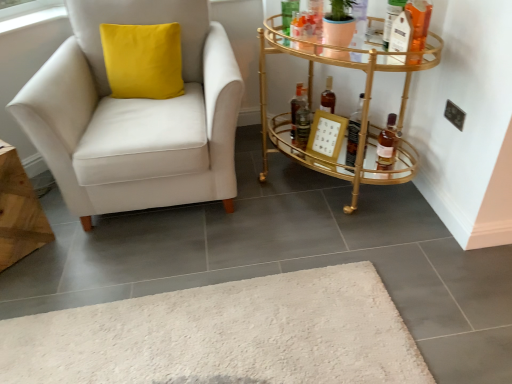
The width and height of the screenshot is (512, 384). Find the location of `gold metallic bar cart at right`. gold metallic bar cart at right is located at coordinates (360, 111).

I want to click on shiny dark brown bottle at center, the 1th bottle positioned from the left, so click(x=297, y=108).

In order to click on translucent glass bottle at right, the second bottle when ordered from right to left in this screenshot , I will do `click(354, 132)`.

Considering the positions of objects translucent glass bottle at right, which appears as the 1th bottle when viewed from the right, and shiny dark brown bottle at center, the 1th bottle positioned from the left, in the image provided, who is more to the left, translucent glass bottle at right, which appears as the 1th bottle when viewed from the right, or shiny dark brown bottle at center, the 1th bottle positioned from the left,?

Positioned to the left is shiny dark brown bottle at center, the 1th bottle positioned from the left.

Is translucent glass bottle at right, which ranks as the third bottle in left-to-right order, next to shiny dark brown bottle at center, acting as the 3th bottle starting from the right?

No, translucent glass bottle at right, which ranks as the third bottle in left-to-right order, is not with shiny dark brown bottle at center, acting as the 3th bottle starting from the right.

How distant is translucent glass bottle at right, which appears as the 1th bottle when viewed from the right, from shiny dark brown bottle at center, the 1th bottle positioned from the left?

A distance of 18.23 inches exists between translucent glass bottle at right, which appears as the 1th bottle when viewed from the right, and shiny dark brown bottle at center, the 1th bottle positioned from the left.

Is translucent glass bottle at right, which ranks as the third bottle in left-to-right order, shorter than shiny dark brown bottle at center, acting as the 3th bottle starting from the right?

Yes.

Considering the sizes of objects shiny dark brown bottle at center, acting as the 3th bottle starting from the right, and translucent glass bottle at right, which ranks as the third bottle in left-to-right order, in the image provided, who is shorter, shiny dark brown bottle at center, acting as the 3th bottle starting from the right, or translucent glass bottle at right, which ranks as the third bottle in left-to-right order,?

translucent glass bottle at right, which ranks as the third bottle in left-to-right order.

There is a translucent glass bottle at right, which ranks as the third bottle in left-to-right order. Where is `the 2nd bottle above it (from the image's perspective)`? The image size is (512, 384). the 2nd bottle above it (from the image's perspective) is located at coordinates (297, 108).

Can you tell me how much shiny dark brown bottle at center, the 1th bottle positioned from the left, and translucent glass bottle at right, which ranks as the third bottle in left-to-right order, differ in facing direction?

The angular difference between shiny dark brown bottle at center, the 1th bottle positioned from the left, and translucent glass bottle at right, which ranks as the third bottle in left-to-right order, is 37.9 degrees.

From a real-world perspective, is shiny dark brown bottle at center, acting as the 3th bottle starting from the right, physically below translucent glass bottle at right, which ranks as the third bottle in left-to-right order?

No, from a real-world perspective, shiny dark brown bottle at center, acting as the 3th bottle starting from the right, is not under translucent glass bottle at right, which ranks as the third bottle in left-to-right order.

Is shiny dark brown bottle at center, acting as the 3th bottle starting from the right, wider than translucent glass bottle at right, the 2th bottle viewed from the left?

In fact, shiny dark brown bottle at center, acting as the 3th bottle starting from the right, might be narrower than translucent glass bottle at right, the 2th bottle viewed from the left.

Is shiny dark brown bottle at center, acting as the 3th bottle starting from the right, turned away from translucent glass bottle at right, the second bottle when ordered from right to left?

shiny dark brown bottle at center, acting as the 3th bottle starting from the right, is not turned away from translucent glass bottle at right, the second bottle when ordered from right to left.

Considering the sizes of objects shiny dark brown bottle at center, the 1th bottle positioned from the left, and translucent glass bottle at right, the 2th bottle viewed from the left, in the image provided, who is smaller, shiny dark brown bottle at center, the 1th bottle positioned from the left, or translucent glass bottle at right, the 2th bottle viewed from the left,?

Smaller between the two is shiny dark brown bottle at center, the 1th bottle positioned from the left.

Is point (295, 96) in front of point (347, 153)?

No, it is behind (347, 153).

Considering the sizes of objects translucent glass bottle at right, the 2th bottle viewed from the left, and shiny dark brown bottle at center, the 1th bottle positioned from the left, in the image provided, who is thinner, translucent glass bottle at right, the 2th bottle viewed from the left, or shiny dark brown bottle at center, the 1th bottle positioned from the left,?

shiny dark brown bottle at center, the 1th bottle positioned from the left.

Is translucent glass bottle at right, the 2th bottle viewed from the left, not near shiny dark brown bottle at center, the 1th bottle positioned from the left?

No.

From a real-world perspective, count 1st bottles downward from the shiny dark brown bottle at center, the 1th bottle positioned from the left, and point to it. Please provide its 2D coordinates.

[(354, 132)]

From the image's perspective, is translucent glass bottle at right, the 2th bottle viewed from the left, under shiny dark brown bottle at center, the 1th bottle positioned from the left?

Correct, translucent glass bottle at right, the 2th bottle viewed from the left, appears lower than shiny dark brown bottle at center, the 1th bottle positioned from the left, in the image.

From the picture: Is translucent glass bottle at right, the second bottle when ordered from right to left, bigger or smaller than white fabric chair at left?

Clearly, translucent glass bottle at right, the second bottle when ordered from right to left, is smaller in size than white fabric chair at left.

From the image's perspective, is translucent glass bottle at right, the second bottle when ordered from right to left, beneath white fabric chair at left?

Yes, from the image's perspective, translucent glass bottle at right, the second bottle when ordered from right to left, is beneath white fabric chair at left.

Looking at this image, do you think translucent glass bottle at right, the 2th bottle viewed from the left, is within white fabric chair at left, or outside of it?

translucent glass bottle at right, the 2th bottle viewed from the left, cannot be found inside white fabric chair at left.

From a real-world perspective, is translucent glass bottle at right, the second bottle when ordered from right to left, physically located above or below white fabric chair at left?

translucent glass bottle at right, the second bottle when ordered from right to left, is situated lower than white fabric chair at left in the real world.

Between white fabric chair at left and gold metallic picture frame at center right, which one is positioned behind?

gold metallic picture frame at center right is further away from the camera.

From the image's perspective, is white fabric chair at left located above gold metallic picture frame at center right?

Correct, white fabric chair at left appears higher than gold metallic picture frame at center right in the image.

From a real-world perspective, is white fabric chair at left beneath gold metallic picture frame at center right?

No, from a real-world perspective, white fabric chair at left is not under gold metallic picture frame at center right.

Does point (74, 47) come closer to viewer compared to point (328, 135)?

No, it is behind (328, 135).

From the image's perspective, is translucent glass bottle at right, which ranks as the third bottle in left-to-right order, located beneath white fabric chair at left?

Yes, from the image's perspective, translucent glass bottle at right, which ranks as the third bottle in left-to-right order, is below white fabric chair at left.

Considering the sizes of objects translucent glass bottle at right, which ranks as the third bottle in left-to-right order, and white fabric chair at left in the image provided, who is thinner, translucent glass bottle at right, which ranks as the third bottle in left-to-right order, or white fabric chair at left?

With smaller width is translucent glass bottle at right, which ranks as the third bottle in left-to-right order.

Which of these two, translucent glass bottle at right, which ranks as the third bottle in left-to-right order, or white fabric chair at left, is bigger?

white fabric chair at left is bigger.

Where is `chair on the left of translucent glass bottle at right, which appears as the 1th bottle when viewed from the right`? This screenshot has width=512, height=384. chair on the left of translucent glass bottle at right, which appears as the 1th bottle when viewed from the right is located at coordinates (135, 116).

Find the location of `bottle that is the 2nd one when counting upward from the translucent glass bottle at right, which appears as the 1th bottle when viewed from the right (from the image's perspective)`. bottle that is the 2nd one when counting upward from the translucent glass bottle at right, which appears as the 1th bottle when viewed from the right (from the image's perspective) is located at coordinates (297, 108).

From the image's perspective, which bottle is the 2nd one below the shiny dark brown bottle at center, the 1th bottle positioned from the left? Please provide its 2D coordinates.

[(387, 144)]

Which object lies nearer to the anchor point gold metallic picture frame at center right, white fabric chair at left or shiny dark brown bottle at center, acting as the 3th bottle starting from the right?

shiny dark brown bottle at center, acting as the 3th bottle starting from the right, lies closer to gold metallic picture frame at center right than the other object.

Looking at the image, which one is located closer to translucent glass bottle at right, which ranks as the third bottle in left-to-right order, gold metallic picture frame at center right or shiny dark brown bottle at center, the 1th bottle positioned from the left?

gold metallic picture frame at center right is closer to translucent glass bottle at right, which ranks as the third bottle in left-to-right order.

Based on their spatial positions, is gold metallic picture frame at center right or translucent glass bottle at right, which appears as the 1th bottle when viewed from the right, closer to gold metallic bar cart at right?

Based on the image, gold metallic picture frame at center right appears to be nearer to gold metallic bar cart at right.

Looking at the image, which one is located closer to translucent glass bottle at right, which appears as the 1th bottle when viewed from the right, translucent glass bottle at right, the 2th bottle viewed from the left, or gold metallic picture frame at center right?

translucent glass bottle at right, the 2th bottle viewed from the left, is positioned closer to the anchor translucent glass bottle at right, which appears as the 1th bottle when viewed from the right.

Estimate the real-world distances between objects in this image. Which object is closer to gold metallic bar cart at right, shiny dark brown bottle at center, acting as the 3th bottle starting from the right, or white fabric chair at left?

Among the two, shiny dark brown bottle at center, acting as the 3th bottle starting from the right, is located nearer to gold metallic bar cart at right.

From the image, which object appears to be farther from translucent glass bottle at right, the 2th bottle viewed from the left, translucent glass bottle at right, which ranks as the third bottle in left-to-right order, or white fabric chair at left?

white fabric chair at left is positioned further to the anchor translucent glass bottle at right, the 2th bottle viewed from the left.

Based on their spatial positions, is translucent glass bottle at right, which appears as the 1th bottle when viewed from the right, or translucent glass bottle at right, the 2th bottle viewed from the left, closer to white fabric chair at left?

Among the two, translucent glass bottle at right, the 2th bottle viewed from the left, is located nearer to white fabric chair at left.

Considering their positions, is white fabric chair at left positioned closer to translucent glass bottle at right, the 2th bottle viewed from the left, than gold metallic picture frame at center right?

gold metallic picture frame at center right.

Image resolution: width=512 pixels, height=384 pixels. I want to click on picture frame between gold metallic bar cart at right and translucent glass bottle at right, which ranks as the third bottle in left-to-right order, along the z-axis, so click(x=326, y=136).

I want to click on table between white fabric chair at left and translucent glass bottle at right, which ranks as the third bottle in left-to-right order, in the horizontal direction, so click(360, 111).

In order to click on bottle between white fabric chair at left and translucent glass bottle at right, the second bottle when ordered from right to left, from left to right in this screenshot , I will do `click(297, 108)`.

This screenshot has height=384, width=512. Find the location of `picture frame situated between white fabric chair at left and translucent glass bottle at right, which appears as the 1th bottle when viewed from the right, from left to right`. picture frame situated between white fabric chair at left and translucent glass bottle at right, which appears as the 1th bottle when viewed from the right, from left to right is located at coordinates (326, 136).